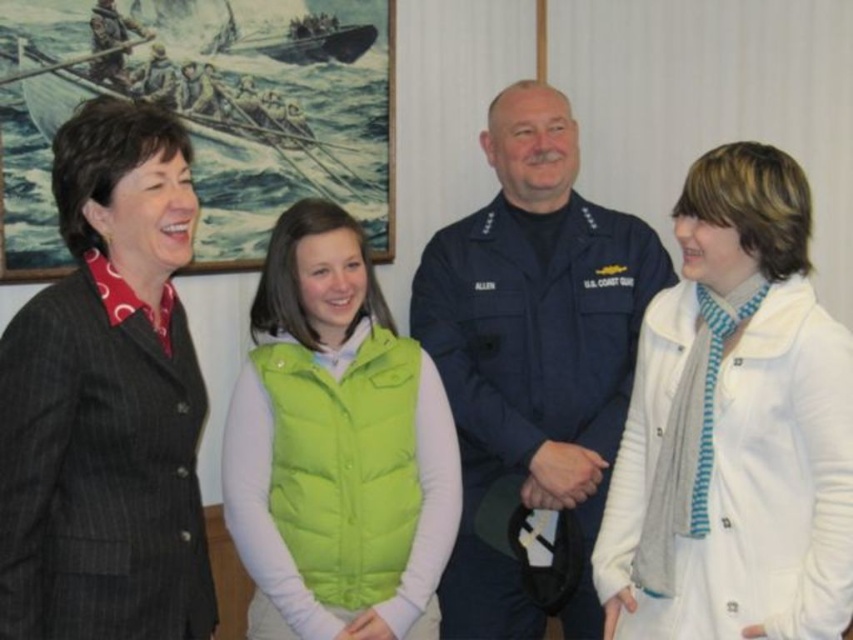
Does dark gray pinstripe suit at left appear on the left side of navy blue uniform at center?

Indeed, dark gray pinstripe suit at left is positioned on the left side of navy blue uniform at center.

Who is more forward, (105,598) or (543,317)?

Point (105,598) is in front.

Is point (148, 156) closer to camera compared to point (532, 403)?

Yes.

Where is `dark gray pinstripe suit at left`? The image size is (853, 640). dark gray pinstripe suit at left is located at coordinates (107, 401).

Who is positioned more to the right, white cotton coat at right or green puffy vest at center?

Positioned to the right is white cotton coat at right.

Does white cotton coat at right appear over green puffy vest at center?

Yes, white cotton coat at right is above green puffy vest at center.

Which is in front, point (693, 561) or point (364, 589)?

Point (693, 561)

This screenshot has height=640, width=853. I want to click on white cotton coat at right, so click(x=734, y=428).

Between point (711, 492) and point (0, 376), which one is positioned in front?

Point (0, 376)

Which is behind, point (788, 179) or point (107, 509)?

Point (788, 179)

You are a GUI agent. You are given a task and a screenshot of the screen. Output one action in this format:
    pyautogui.click(x=<x>, y=<y>)
    Task: Click on the white cotton coat at right
    The width and height of the screenshot is (853, 640).
    Given the screenshot: What is the action you would take?
    (734, 428)